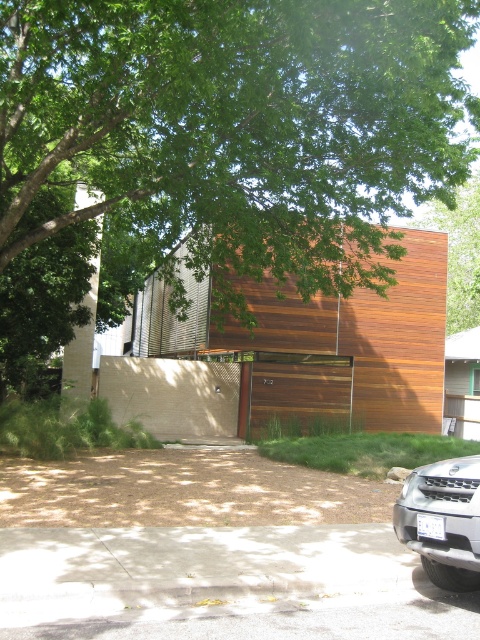
You are standing at the entrance of the residential building and want to plant a new tree in the front yard. The existing green leafy tree at upper center is already present. Based on its position, can you determine if there is enough space to plant another tree 2 meters away from it?

The green leafy tree at upper center is located at point (228, 134). Since the question does not provide information about the available space or distance from other objects, it is impossible to determine if there is enough space to plant another tree 2 meters away from it.

You are a delivery person approaching the house and need to locate the wooden garage door at center. Based on the green leafy tree at upper center, where should you look relative to the tree?

The wooden garage door at center is on the right side of the green leafy tree at upper center.